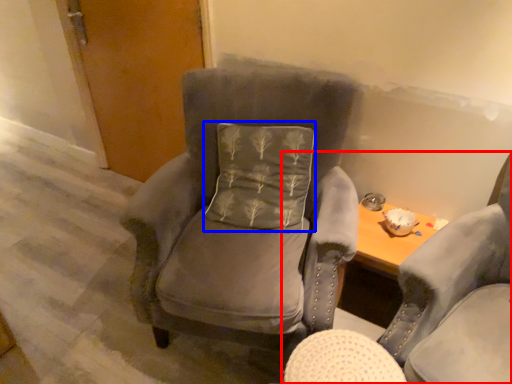
Question: Which object appears closest to the camera in this image, chair (highlighted by a red box) or pillow (highlighted by a blue box)?

Choices:
 (A) chair
 (B) pillow

Answer: (A)